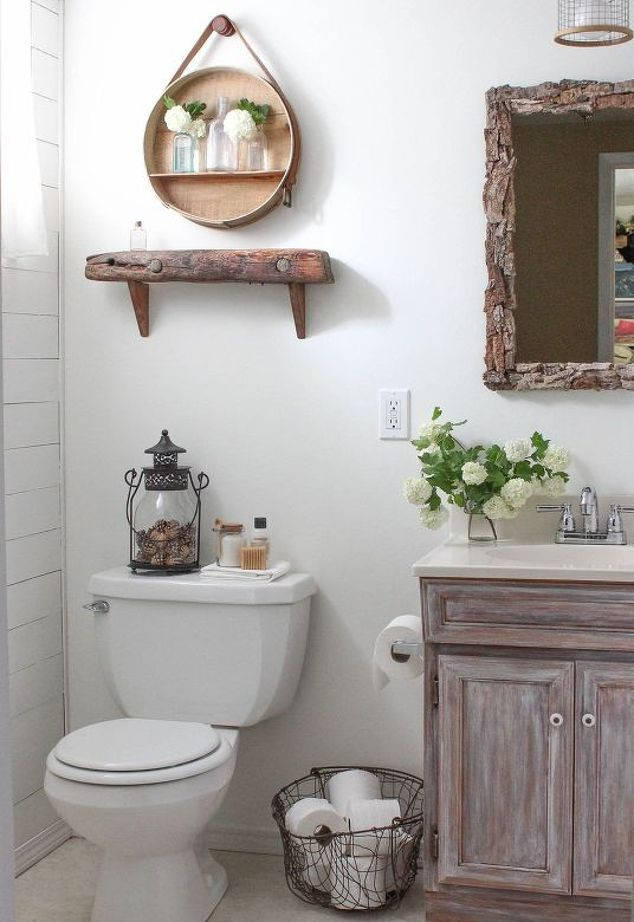
Where is `floor`? floor is located at coordinates (267, 892), (49, 893).